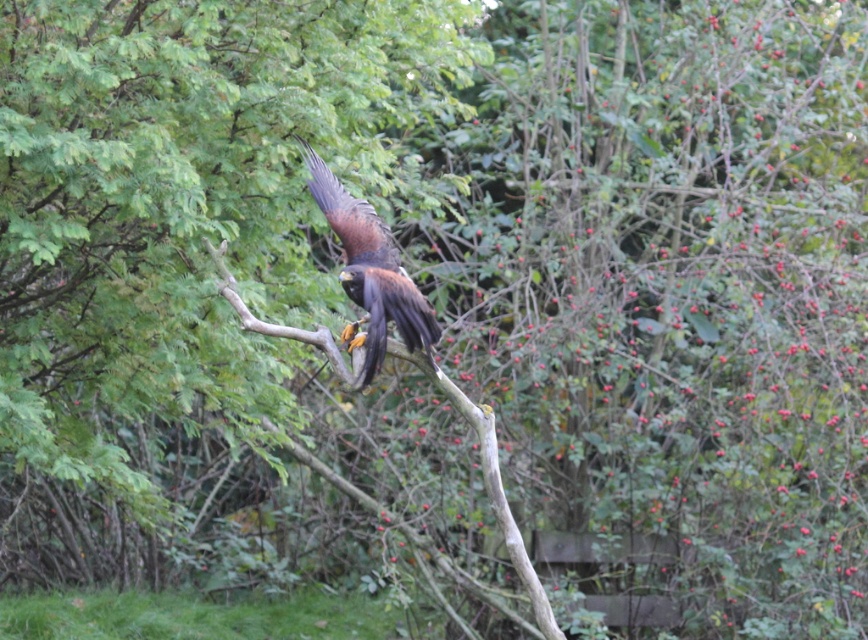
Is point (372, 259) closer to camera compared to point (293, 337)?

That is False.

What are the coordinates of `brown feathered eagle at center` in the screenshot? It's located at (372, 269).